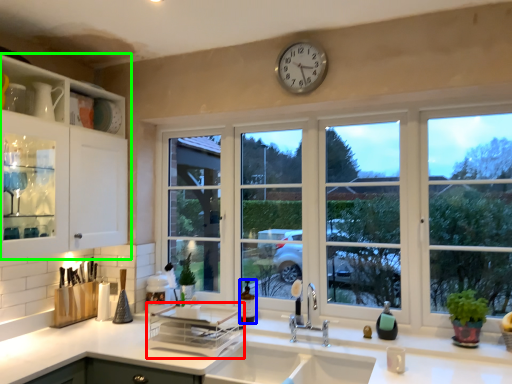
Question: Based on their relative distances, which object is nearer to appliance (highlighted by a red box)? Choose from bottle (highlighted by a blue box) and cabinetry (highlighted by a green box).

Choices:
 (A) bottle
 (B) cabinetry

Answer: (A)